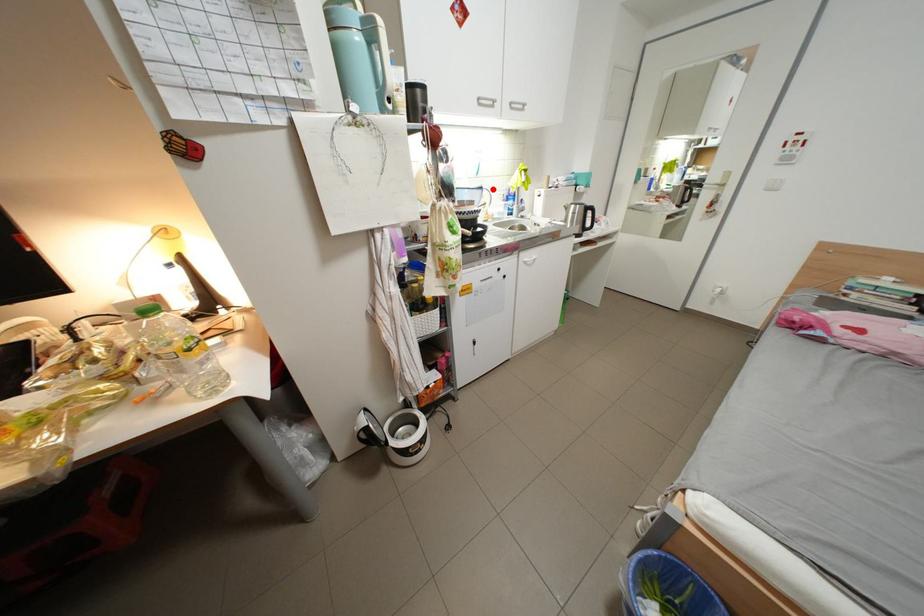
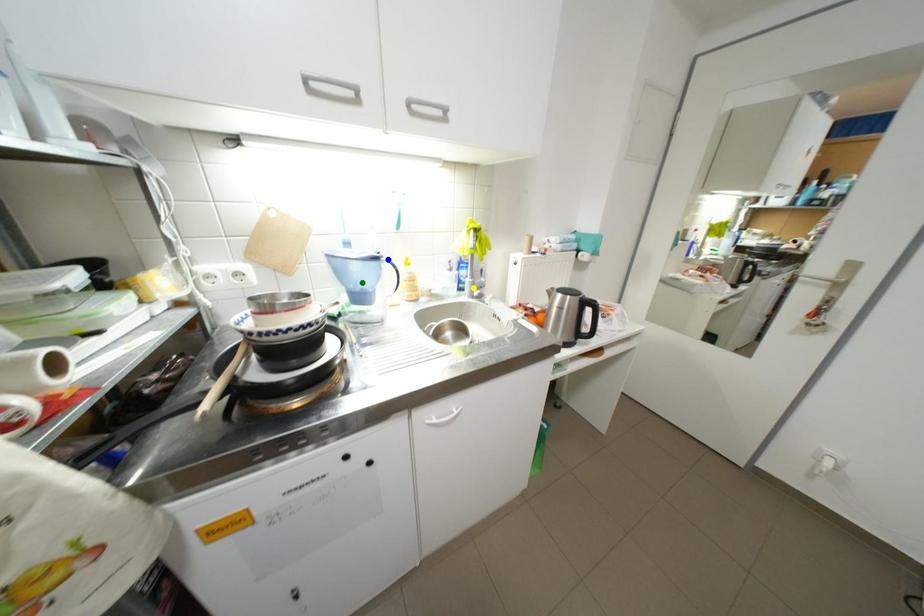
Question: I am providing you with two images of the same scene from different viewpoints. A red point is marked on the first image. You are given multiple points on the second image. In image 2, which mark is for the same physical point as the one in image 1?

Choices:
 (A) blue point
 (B) green point
 (C) yellow point

Answer: (A)